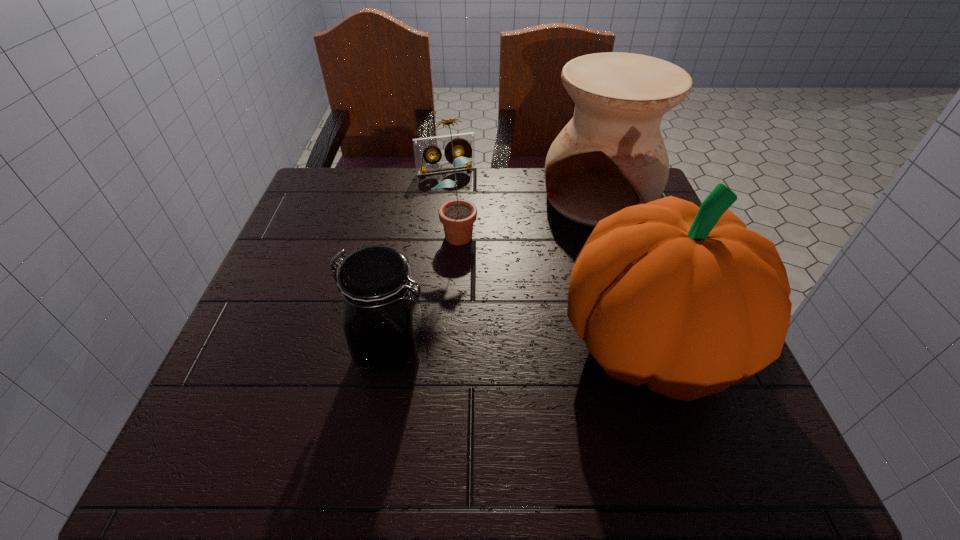
Identify the location of free space located 0.330m on the flower of the sunflower. Image resolution: width=960 pixels, height=540 pixels. (499, 367).

Locate an element on the screen. This screenshot has width=960, height=540. vacant space situated on the flower of the sunflower is located at coordinates (487, 328).

Where is `vacant region located 0.150m at the open side of the pottery`? The width and height of the screenshot is (960, 540). vacant region located 0.150m at the open side of the pottery is located at coordinates (556, 266).

The height and width of the screenshot is (540, 960). In order to click on vacant area situated at the open side of the pottery in this screenshot , I will do `click(567, 247)`.

Find the location of a particular element. This screenshot has height=540, width=960. blank area located 0.190m at the open side of the pottery is located at coordinates (549, 277).

You are a GUI agent. You are given a task and a screenshot of the screen. Output one action in this format:
    pyautogui.click(x=<x>, y=<y>)
    Task: Click on the vacant space situated 0.100m at the front of the shortest object with visible reels
    
    Given the screenshot: What is the action you would take?
    pyautogui.click(x=460, y=197)

Where is `vacant space positioned at the front of the shortest object with visible reels`? Image resolution: width=960 pixels, height=540 pixels. vacant space positioned at the front of the shortest object with visible reels is located at coordinates (489, 275).

Where is `vacant space located at the front of the shortest object with visible reels`? The height and width of the screenshot is (540, 960). vacant space located at the front of the shortest object with visible reels is located at coordinates (481, 254).

Where is `sunflower that is at the far edge`? This screenshot has width=960, height=540. sunflower that is at the far edge is located at coordinates (457, 216).

Identify the location of pottery that is at the far edge. Image resolution: width=960 pixels, height=540 pixels. (611, 155).